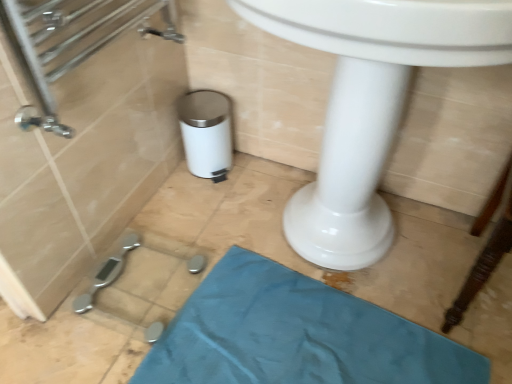
Question: Is teal fabric bath mat at lower center further to the viewer compared to white glossy sink at center?

Choices:
 (A) no
 (B) yes

Answer: (B)

Question: From the image's perspective, does teal fabric bath mat at lower center appear lower than white glossy sink at center?

Choices:
 (A) no
 (B) yes

Answer: (B)

Question: Is teal fabric bath mat at lower center turned away from white glossy sink at center?

Choices:
 (A) yes
 (B) no

Answer: (A)

Question: Does teal fabric bath mat at lower center have a lesser width compared to white glossy sink at center?

Choices:
 (A) yes
 (B) no

Answer: (A)

Question: From the image's perspective, is teal fabric bath mat at lower center on white glossy sink at center?

Choices:
 (A) no
 (B) yes

Answer: (A)

Question: Does teal fabric bath mat at lower center have a greater height compared to white glossy sink at center?

Choices:
 (A) yes
 (B) no

Answer: (B)

Question: Is white glossy sink at center beside teal fabric bath mat at lower center?

Choices:
 (A) no
 (B) yes

Answer: (A)

Question: Does white glossy sink at center have a greater width compared to teal fabric bath mat at lower center?

Choices:
 (A) no
 (B) yes

Answer: (B)

Question: Does white glossy sink at center lie in front of teal fabric bath mat at lower center?

Choices:
 (A) yes
 (B) no

Answer: (A)

Question: Does white glossy sink at center have a smaller size compared to teal fabric bath mat at lower center?

Choices:
 (A) yes
 (B) no

Answer: (B)

Question: Does white glossy sink at center turn towards teal fabric bath mat at lower center?

Choices:
 (A) yes
 (B) no

Answer: (A)

Question: From a real-world perspective, is white glossy sink at center positioned under teal fabric bath mat at lower center based on gravity?

Choices:
 (A) no
 (B) yes

Answer: (A)

Question: Visually, is white glossy sink at center positioned to the left or to the right of teal fabric bath mat at lower center?

Choices:
 (A) right
 (B) left

Answer: (A)